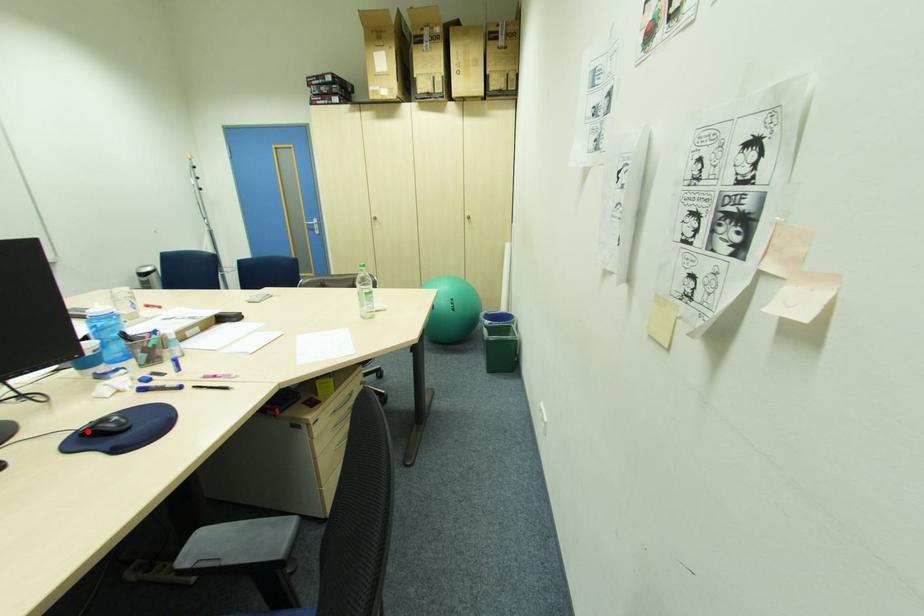
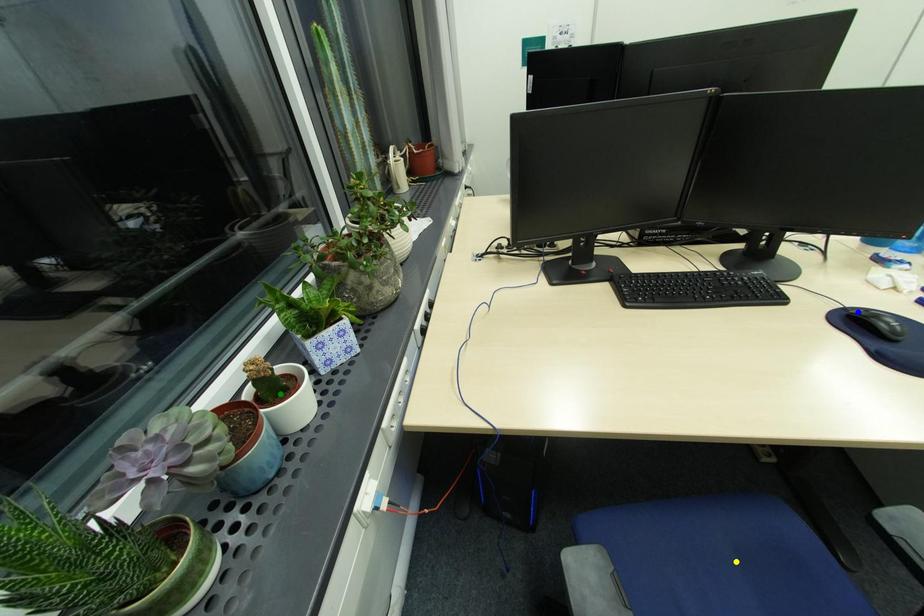
Question: I am providing you with two images of the same scene from different viewpoints. A red point is marked on the first image. You are given multiple points on the second image. Which mark in image 2 goes with the point in image 1?

Choices:
 (A) green point
 (B) blue point
 (C) yellow point

Answer: (B)